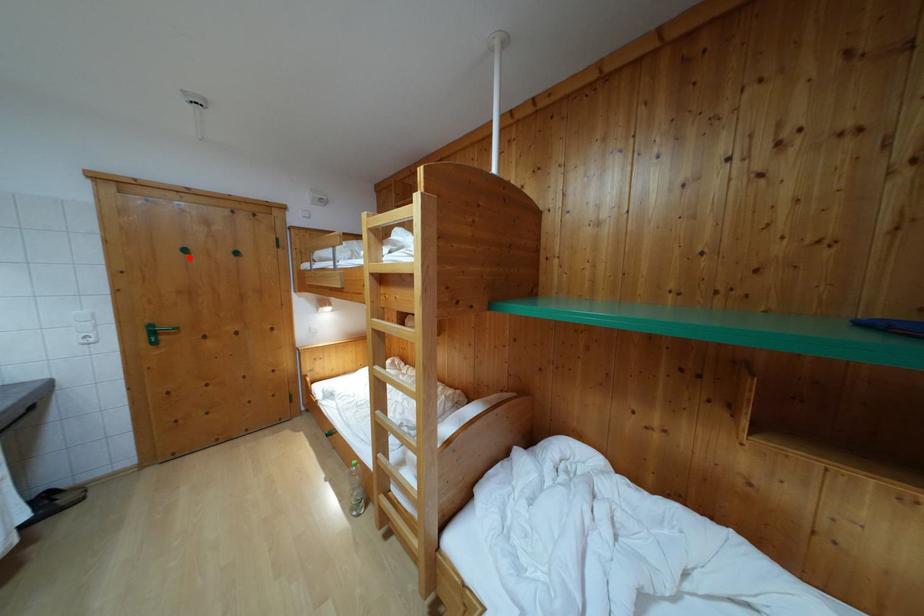
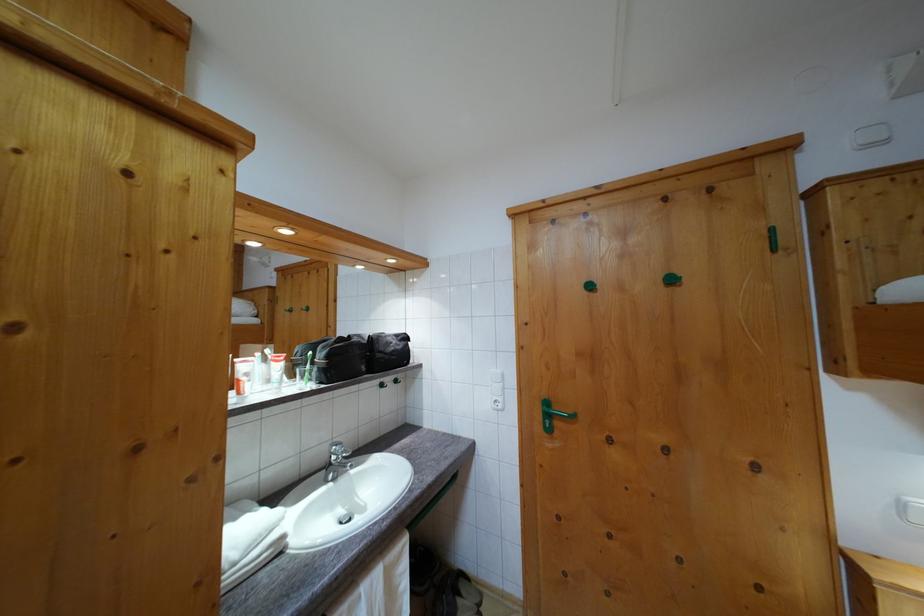
Where in the second image is the point corresponding to the highlighted location from the first image?

(593, 294)